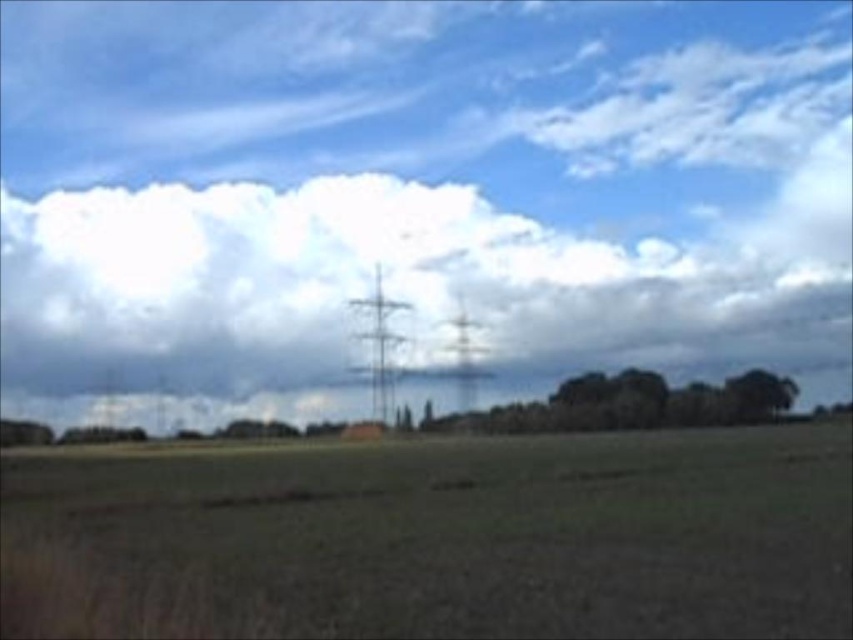
Is point (184, 545) farther from camera compared to point (643, 397)?

No.

Is brown grassy field at center taller than green leafy trees at center?

No, brown grassy field at center is not taller than green leafy trees at center.

Is point (521, 589) positioned after point (509, 419)?

No.

Locate an element on the screen. This screenshot has height=640, width=853. brown grassy field at center is located at coordinates (439, 536).

Does brown grassy field at center appear on the left side of white fluffy cloud at upper center?

Yes, brown grassy field at center is to the left of white fluffy cloud at upper center.

From the picture: Can you confirm if brown grassy field at center is positioned below white fluffy cloud at upper center?

Yes.

Is point (241, 572) farther from viewer compared to point (544, 227)?

No, (241, 572) is closer to viewer.

You are a GUI agent. You are given a task and a screenshot of the screen. Output one action in this format:
    pyautogui.click(x=<x>, y=<y>)
    Task: Click on the brown grassy field at center
    This screenshot has height=640, width=853.
    Given the screenshot: What is the action you would take?
    pyautogui.click(x=439, y=536)

Which is below, brown grassy field at center or green leafy tree at lower right?

brown grassy field at center is below.

This screenshot has width=853, height=640. Identify the location of brown grassy field at center. (439, 536).

Identify the location of brown grassy field at center. (439, 536).